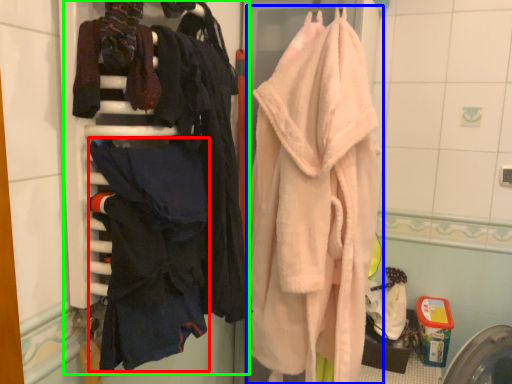
Question: Which is farther away from clothing (highlighted by a red box)? towel (highlighted by a blue box) or closet (highlighted by a green box)?

Choices:
 (A) towel
 (B) closet

Answer: (A)